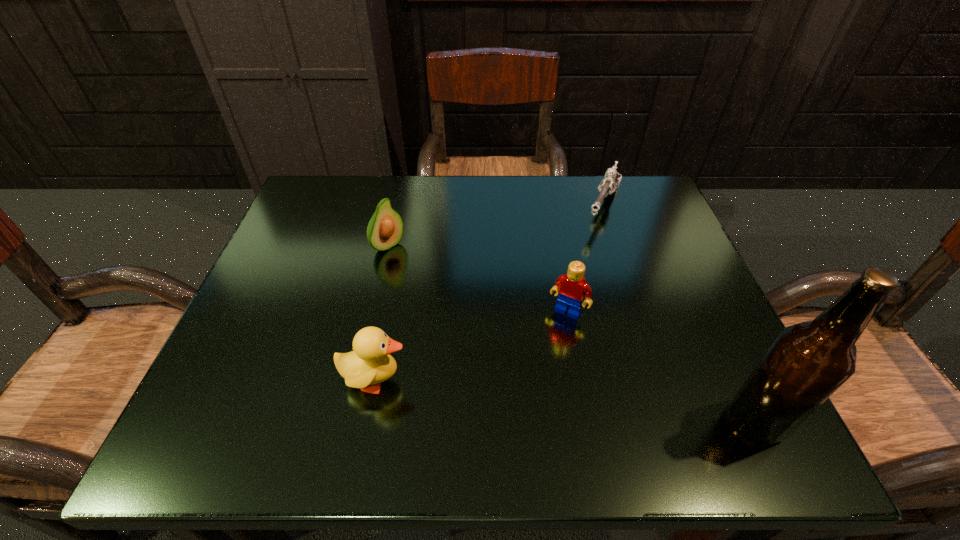
You are a GUI agent. You are given a task and a screenshot of the screen. Output one action in this format:
    pyautogui.click(x=<x>, y=<y>)
    Task: Click on the free space on the desktop that is between the duckling and the rightmost object and is positioned on the front-facing side of the third farthest object
    
    Given the screenshot: What is the action you would take?
    pyautogui.click(x=521, y=395)

Locate an element on the screen. The image size is (960, 540). vacant space on the desktop that is between the duckling and the rightmost object and is positioned on the cut side of the second farthest object is located at coordinates (591, 403).

Locate an element on the screen. This screenshot has width=960, height=540. vacant space on the desktop that is between the duckling and the rightmost object and is positioned aimed along the barrel of the fourth object from left to right is located at coordinates (512, 395).